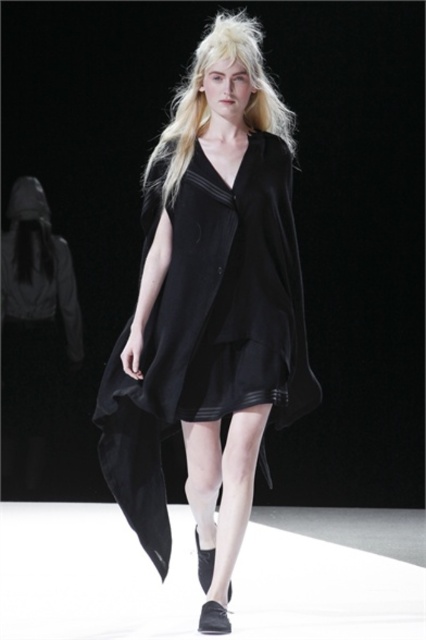
Question: In this image, where is black matte dress at center located relative to blonde silky hair at center?

Choices:
 (A) above
 (B) below

Answer: (B)

Question: Is black matte dress at center smaller than blonde silky hair at center?

Choices:
 (A) yes
 (B) no

Answer: (B)

Question: Which point is closer to the camera?

Choices:
 (A) black matte dress at center
 (B) blonde silky hair at center

Answer: (A)

Question: Is black matte dress at center wider than blonde silky hair at center?

Choices:
 (A) no
 (B) yes

Answer: (B)

Question: Which object is closer to the camera taking this photo?

Choices:
 (A) black matte dress at center
 (B) blonde silky hair at center

Answer: (A)

Question: Which point appears closest to the camera in this image?

Choices:
 (A) (187, 148)
 (B) (242, 288)

Answer: (B)